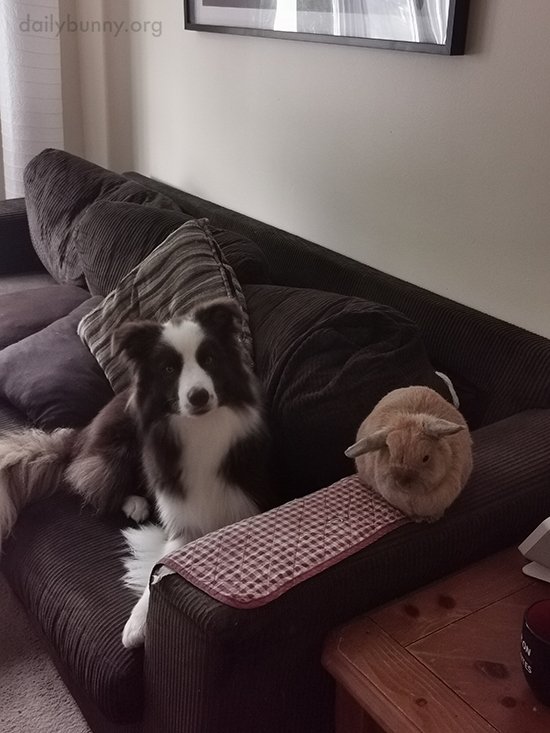
This screenshot has width=550, height=733. Find the location of `carpet`. carpet is located at coordinates (43, 696).